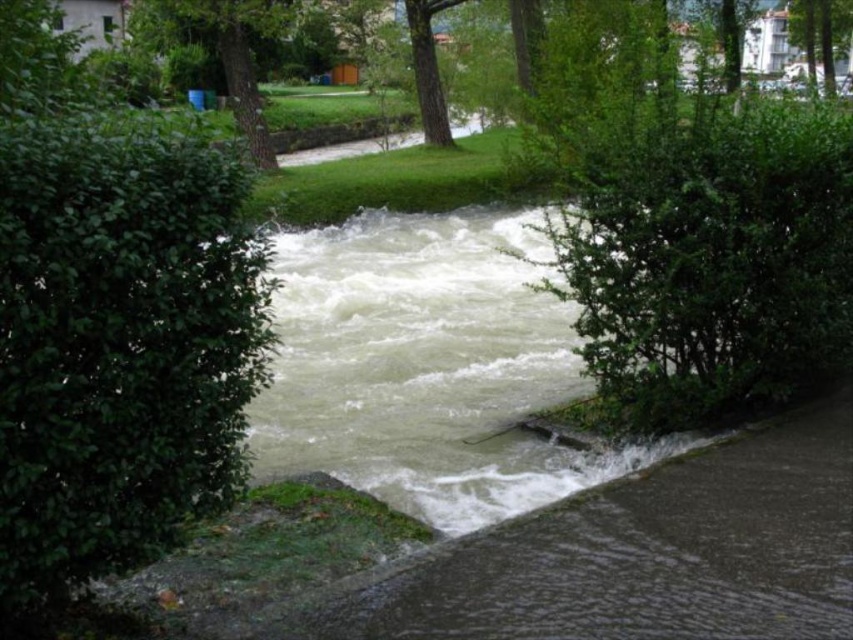
Between green leafy hedge at center and green leafy tree at upper center, which one is positioned lower?

green leafy hedge at center is lower down.

Describe the element at coordinates (711, 262) in the screenshot. I see `green leafy hedge at center` at that location.

Does point (692, 182) come closer to viewer compared to point (193, 28)?

Yes, point (692, 182) is in front of point (193, 28).

The width and height of the screenshot is (853, 640). Identify the location of green leafy hedge at center. (711, 262).

Is green leafy hedge at left wider than green leafy tree at center?

Incorrect, green leafy hedge at left's width does not surpass green leafy tree at center's.

Is green leafy hedge at left to the right of green leafy tree at center from the viewer's perspective?

Incorrect, green leafy hedge at left is not on the right side of green leafy tree at center.

What do you see at coordinates (119, 346) in the screenshot? I see `green leafy hedge at left` at bounding box center [119, 346].

You are a GUI agent. You are given a task and a screenshot of the screen. Output one action in this format:
    pyautogui.click(x=<x>, y=<y>)
    Task: Click on the green leafy hedge at left
    The image size is (853, 640).
    Given the screenshot: What is the action you would take?
    pyautogui.click(x=119, y=346)

The width and height of the screenshot is (853, 640). I want to click on green leafy hedge at left, so click(x=119, y=346).

This screenshot has width=853, height=640. What do you see at coordinates (119, 346) in the screenshot? I see `green leafy hedge at left` at bounding box center [119, 346].

Is point (71, 355) positioned before point (169, 52)?

Yes, it is.

Locate an element on the screen. green leafy hedge at left is located at coordinates (119, 346).